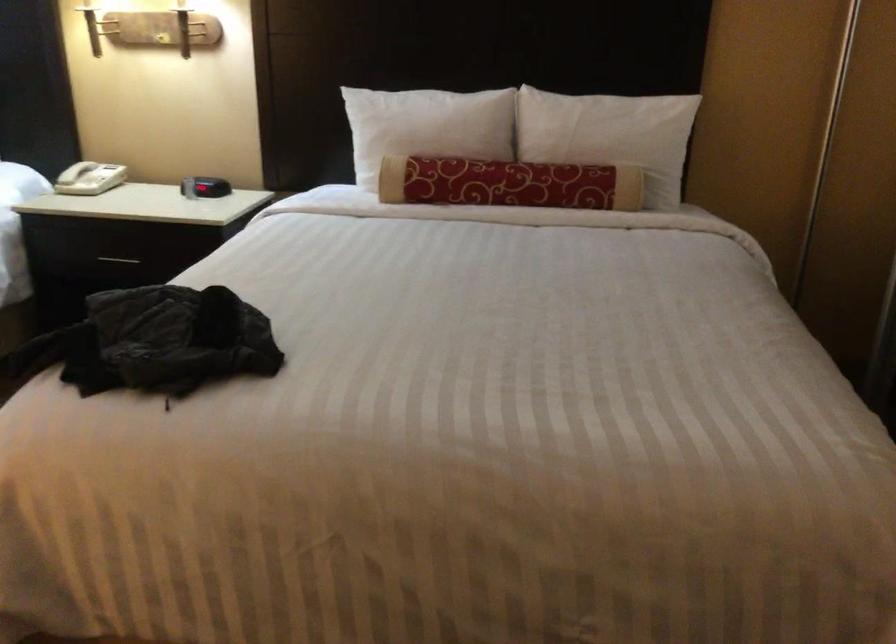
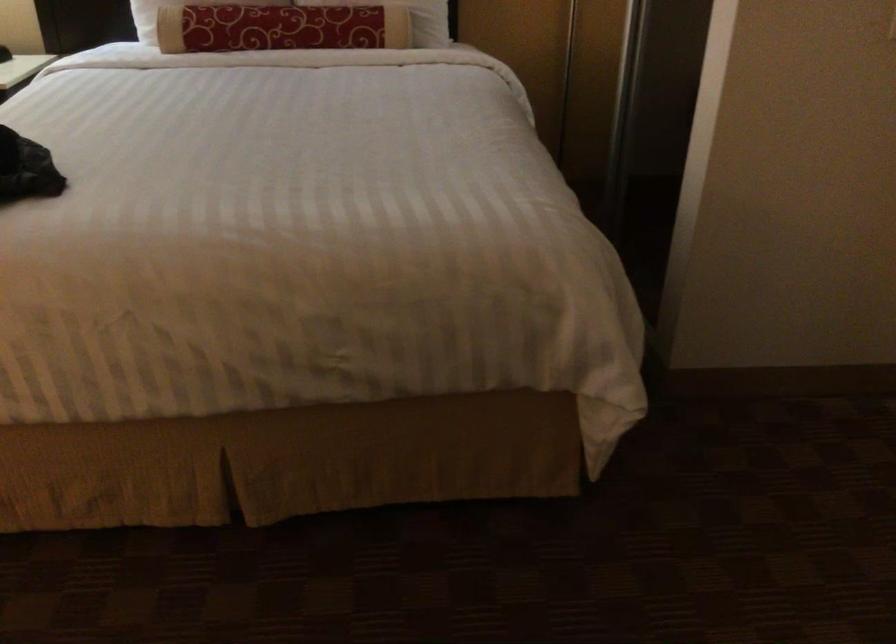
Question: Based on the continuous images, in which direction is the camera rotating? Reply with the corresponding letter.

Choices:
 (A) Left
 (B) Right
 (C) Up
 (D) Down

Answer: (B)